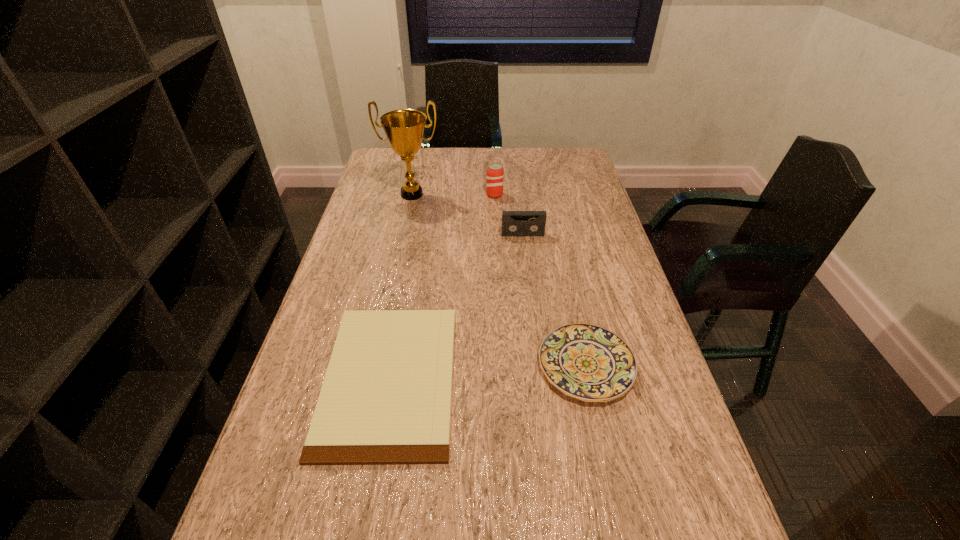
Image resolution: width=960 pixels, height=540 pixels. Identify the location of vacant region that satisfies the following two spatial constraints: 1. on the front view with handles of the fourth shortest object; 2. on the right side of the award. (412, 194).

The image size is (960, 540). Find the location of `free point that satisfies the following two spatial constraints: 1. on the front view with handles of the award; 2. on the right side of the clipboard`. free point that satisfies the following two spatial constraints: 1. on the front view with handles of the award; 2. on the right side of the clipboard is located at coordinates (372, 377).

The height and width of the screenshot is (540, 960). What are the coordinates of `free space that satisfies the following two spatial constraints: 1. on the back side of the fourth shortest object; 2. on the right side of the clipboard` in the screenshot? It's located at (422, 194).